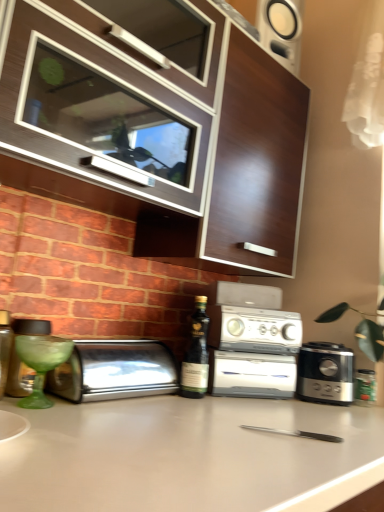
Where is `vacant space situated on the left part of green glass jar at right, which appears as the 1th bottle when viewed from the back`? This screenshot has width=384, height=512. vacant space situated on the left part of green glass jar at right, which appears as the 1th bottle when viewed from the back is located at coordinates (317, 403).